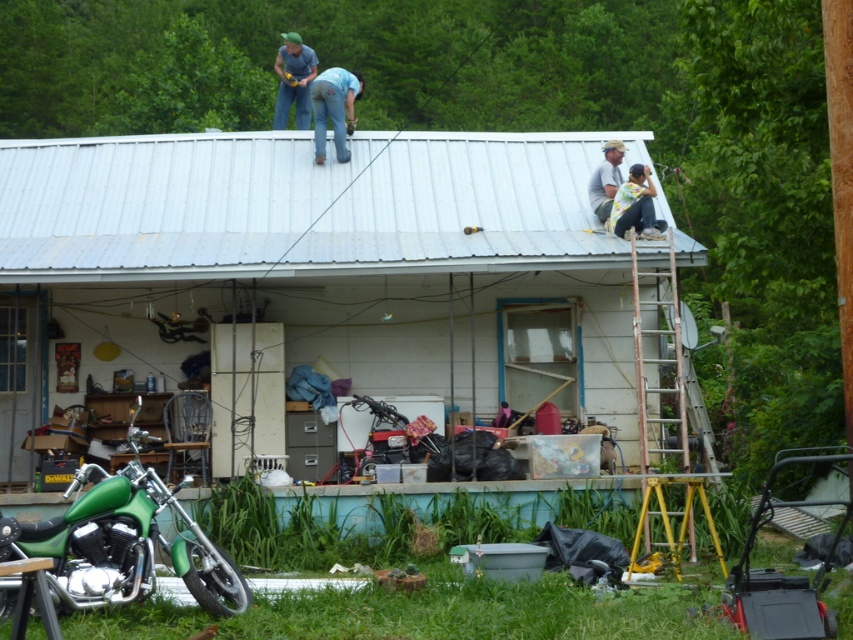
Question: Which point is farther to the camera?

Choices:
 (A) blue fabric shirt at upper center
 (B) blue denim jeans at upper center
 (C) white cotton shirt at upper right

Answer: (A)

Question: Does metallic silver roof at upper center appear on the right side of blue denim jeans at upper center?

Choices:
 (A) yes
 (B) no

Answer: (A)

Question: Is rusty metal ladder at right smaller than white cotton shirt at upper right?

Choices:
 (A) yes
 (B) no

Answer: (B)

Question: Can you confirm if green matte motorcycle at lower left is positioned to the right of blue denim jeans at upper center?

Choices:
 (A) no
 (B) yes

Answer: (A)

Question: Estimate the real-world distances between objects in this image. Which object is farther from the rusty metal ladder at right?

Choices:
 (A) metallic silver roof at upper center
 (B) green matte motorcycle at lower left
 (C) blue denim jeans at upper center

Answer: (C)

Question: Among these points, which one is farthest from the camera?

Choices:
 (A) (699, 445)
 (B) (131, 561)
 (C) (305, 109)

Answer: (C)